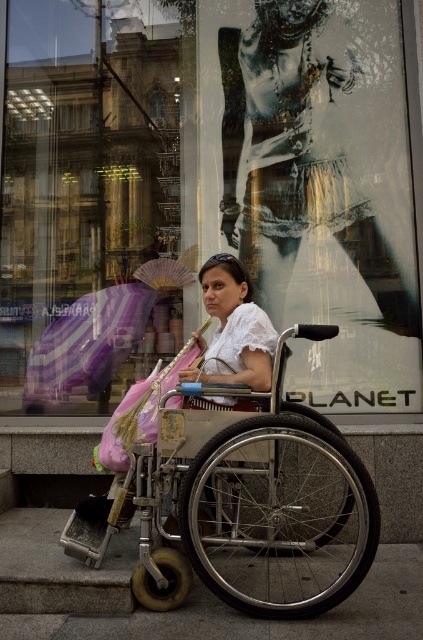
Can you confirm if gray concrete pavement at lower center is positioned below striped fabric umbrella at left?

Yes, gray concrete pavement at lower center is below striped fabric umbrella at left.

Is gray concrete pavement at lower center further to the viewer compared to striped fabric umbrella at left?

No, gray concrete pavement at lower center is in front of striped fabric umbrella at left.

Which is behind, point (118, 621) or point (76, 394)?

Point (76, 394)

This screenshot has width=423, height=640. I want to click on gray concrete pavement at lower center, so click(184, 602).

Identify the location of gray concrete pavement at lower center. (184, 602).

The width and height of the screenshot is (423, 640). What do you see at coordinates (184, 602) in the screenshot?
I see `gray concrete pavement at lower center` at bounding box center [184, 602].

Where is `gray concrete pavement at lower center`? Image resolution: width=423 pixels, height=640 pixels. gray concrete pavement at lower center is located at coordinates (184, 602).

Is matte purple umbrella at left shorter than striped fabric umbrella at left?

Incorrect, matte purple umbrella at left's height does not fall short of striped fabric umbrella at left's.

Identify the location of matte purple umbrella at left. This screenshot has height=640, width=423. (87, 198).

At what (x,y) coordinates should I click in order to perform the action: click on matte purple umbrella at left. Please return your answer as a coordinate pair (x, y). This screenshot has width=423, height=640. Looking at the image, I should click on (87, 198).

Find the location of a particular element. The height and width of the screenshot is (640, 423). matte purple umbrella at left is located at coordinates (87, 198).